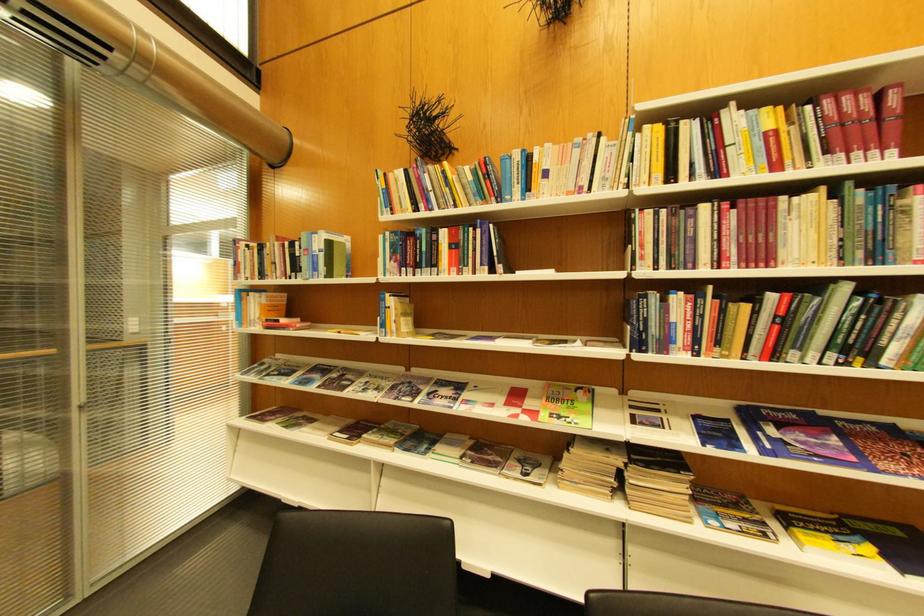
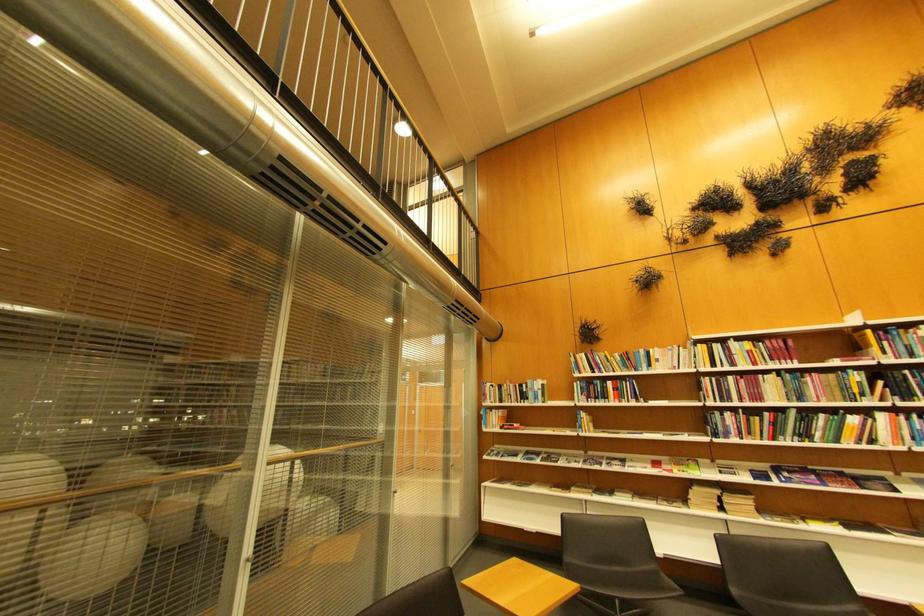
Locate, in the second image, the point that corresponds to the point at 528,191 in the first image.

(654, 368)